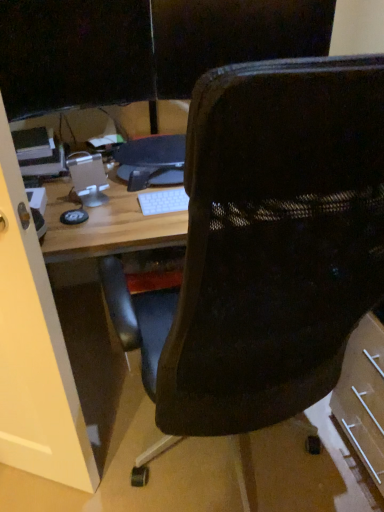
Question: Should I look upward or downward to see black mesh chair at center?

Choices:
 (A) up
 (B) down

Answer: (B)

Question: Does black plastic monitor at center touch black mesh chair at center?

Choices:
 (A) no
 (B) yes

Answer: (A)

Question: From a real-world perspective, is black plastic monitor at center located beneath black mesh chair at center?

Choices:
 (A) no
 (B) yes

Answer: (A)

Question: Is the depth of black plastic monitor at center less than that of black mesh chair at center?

Choices:
 (A) no
 (B) yes

Answer: (A)

Question: Considering the relative sizes of black plastic monitor at center and black mesh chair at center in the image provided, is black plastic monitor at center taller than black mesh chair at center?

Choices:
 (A) yes
 (B) no

Answer: (B)

Question: Does black plastic monitor at center have a larger size compared to black mesh chair at center?

Choices:
 (A) yes
 (B) no

Answer: (B)

Question: Does black plastic monitor at center turn towards black mesh chair at center?

Choices:
 (A) yes
 (B) no

Answer: (A)

Question: Is transparent glass door at left beside black mesh chair at center?

Choices:
 (A) yes
 (B) no

Answer: (B)

Question: Would you say transparent glass door at left is a long distance from black mesh chair at center?

Choices:
 (A) yes
 (B) no

Answer: (B)

Question: From a real-world perspective, is transparent glass door at left under black mesh chair at center?

Choices:
 (A) yes
 (B) no

Answer: (A)

Question: From the image's perspective, is transparent glass door at left located above black mesh chair at center?

Choices:
 (A) yes
 (B) no

Answer: (B)

Question: Is transparent glass door at left positioned in front of black mesh chair at center?

Choices:
 (A) no
 (B) yes

Answer: (A)

Question: Is transparent glass door at left taller than black mesh chair at center?

Choices:
 (A) no
 (B) yes

Answer: (A)

Question: From the image's perspective, is transparent glass door at left below black plastic monitor at center?

Choices:
 (A) yes
 (B) no

Answer: (A)